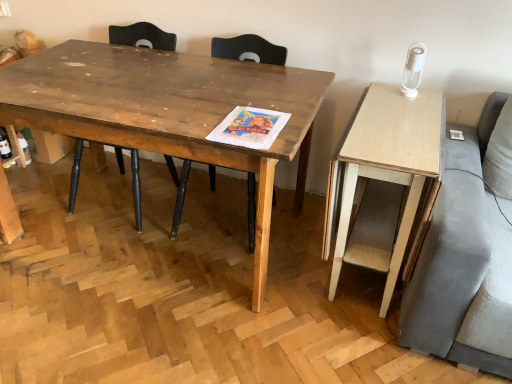
At what (x,y) coordinates should I click in order to perform the action: click on free point below wooden table at center (from a real-world perspective). Please return your answer as a coordinate pair (x, y). The image size is (512, 384). Looking at the image, I should click on (153, 241).